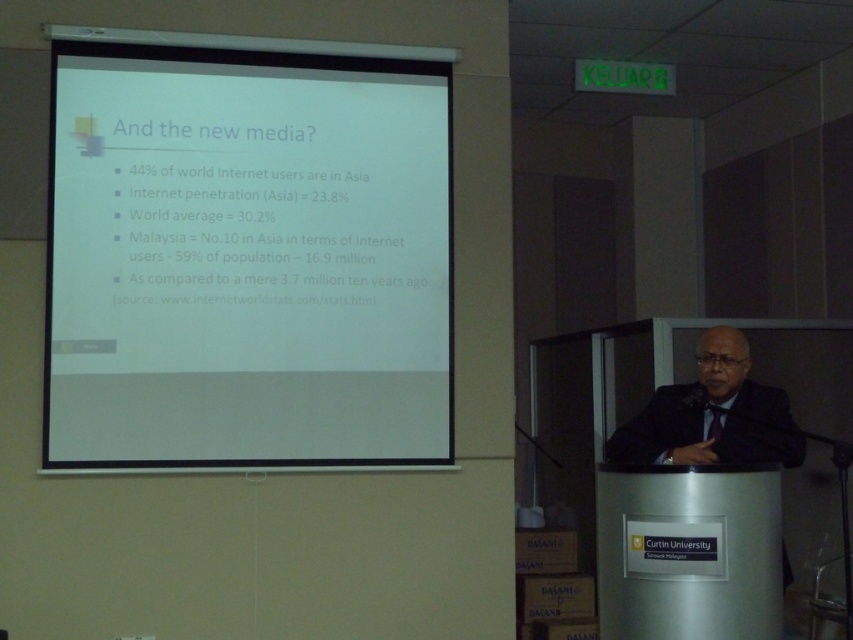
You are an event organizer at Curtin University and need to ensure that the black suit at center is visible to all attendees. Considering the white matte projector screen at upper center is larger in width, should you adjust the speaker position to the side or keep him centered?

The white matte projector screen at upper center is wider than the black suit at center, so keeping the speaker centered ensures his black suit at center remains aligned with the screen, maintaining visibility for all attendees.

You are an attendee at the Curtin University presentation. You need to look at the slide on the white matte projector screen at upper center while also watching the speaker in the black suit at center. Which object should you look at first if you want to see the speaker first?

The black suit at center is below the white matte projector screen at upper center, so you should look at the black suit at center first if you want to see the speaker before the slide.